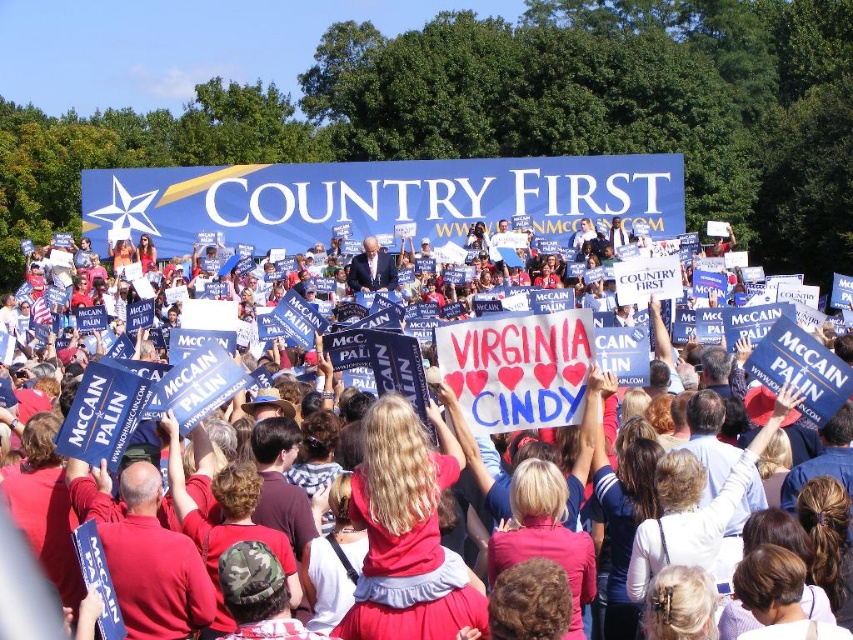
Is red fabric crowd at center wider than blue fabric suit at center?

Yes.

Which is more to the right, red fabric crowd at center or blue fabric suit at center?

Positioned to the right is red fabric crowd at center.

Is point (820, 406) more distant than point (364, 257)?

No, it is not.

This screenshot has width=853, height=640. Identify the location of red fabric crowd at center. (804, 371).